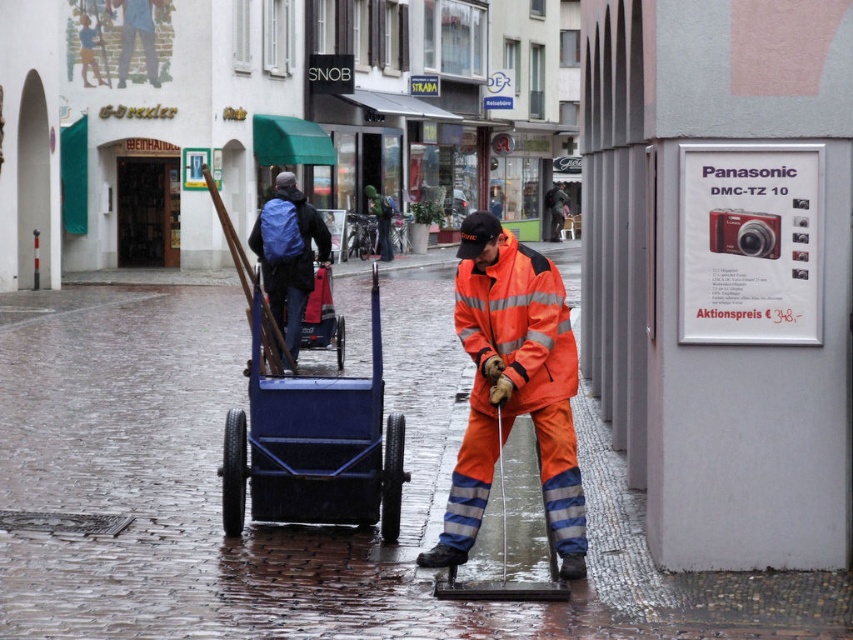
Which is in front, point (471, 435) or point (300, 428)?

Positioned in front is point (471, 435).

Which is behind, point (563, 532) or point (285, 401)?

The point (285, 401) is more distant.

In order to click on orange reflective fabric at center in this screenshot , I will do `click(515, 387)`.

Which is more to the left, wet cobblestone pavement at center or orange reflective fabric at center?

Positioned to the left is wet cobblestone pavement at center.

Is point (132, 356) closer to camera compared to point (492, 321)?

No, (132, 356) is further to viewer.

You are a GUI agent. You are given a task and a screenshot of the screen. Output one action in this format:
    pyautogui.click(x=<x>, y=<y>)
    Task: Click on the wet cobblestone pavement at center
    
    Given the screenshot: What is the action you would take?
    pyautogui.click(x=297, y=525)

Can you confirm if orange reflective fabric at center is wider than blue backpack at center?

Yes.

Can you confirm if orange reflective fabric at center is bigger than blue backpack at center?

Yes.

Does point (543, 346) lie behind point (273, 237)?

No, it is in front of (273, 237).

Find the location of a particular element. Image resolution: width=853 pixels, height=640 pixels. orange reflective fabric at center is located at coordinates (515, 387).